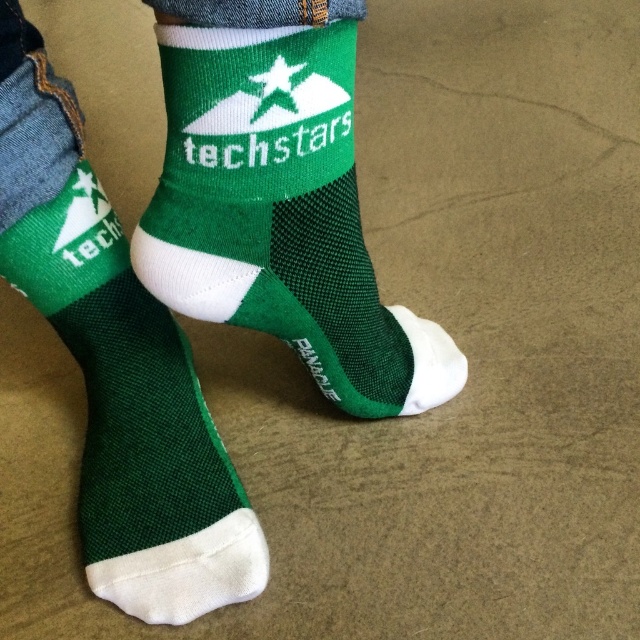
Between point (80, 316) and point (412, 356), which one is positioned in front?

Point (80, 316) is more forward.

Between green mesh sock at lower left and green mesh sock at center, which one appears on the left side from the viewer's perspective?

green mesh sock at lower left

The width and height of the screenshot is (640, 640). Identify the location of green mesh sock at lower left. (134, 420).

The image size is (640, 640). Describe the element at coordinates (195, 275) in the screenshot. I see `green mesh socks at center` at that location.

Which is behind, point (244, 218) or point (342, 218)?

The point (342, 218) is behind.

This screenshot has height=640, width=640. In order to click on green mesh socks at center in this screenshot , I will do `click(195, 275)`.

Is green mesh socks at center taller than green mesh sock at lower left?

Yes, green mesh socks at center is taller than green mesh sock at lower left.

Between green mesh socks at center and green mesh sock at lower left, which one has less height?

green mesh sock at lower left

Image resolution: width=640 pixels, height=640 pixels. What do you see at coordinates (195, 275) in the screenshot?
I see `green mesh socks at center` at bounding box center [195, 275].

You are a GUI agent. You are given a task and a screenshot of the screen. Output one action in this format:
    pyautogui.click(x=<x>, y=<y>)
    Task: Click on the green mesh socks at center
    
    Given the screenshot: What is the action you would take?
    pyautogui.click(x=195, y=275)